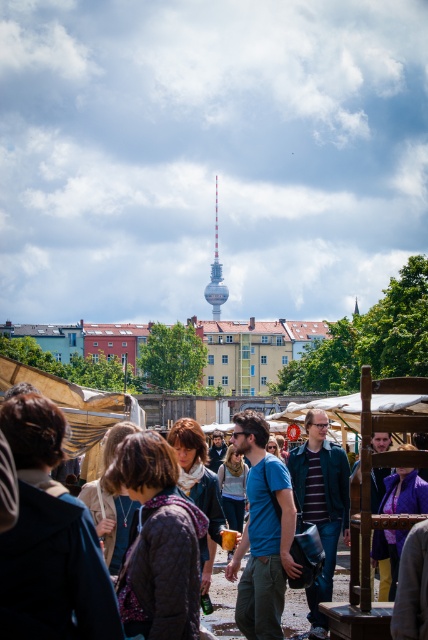
Is point (154, 467) less distant than point (216, 224)?

Yes, it is.

Does blue denim jacket at center have a lesser width compared to metallic silver tower at center?

No.

Which is in front, point (237, 556) or point (214, 289)?

Point (237, 556)

Identify the location of blue denim jacket at center. (392, 420).